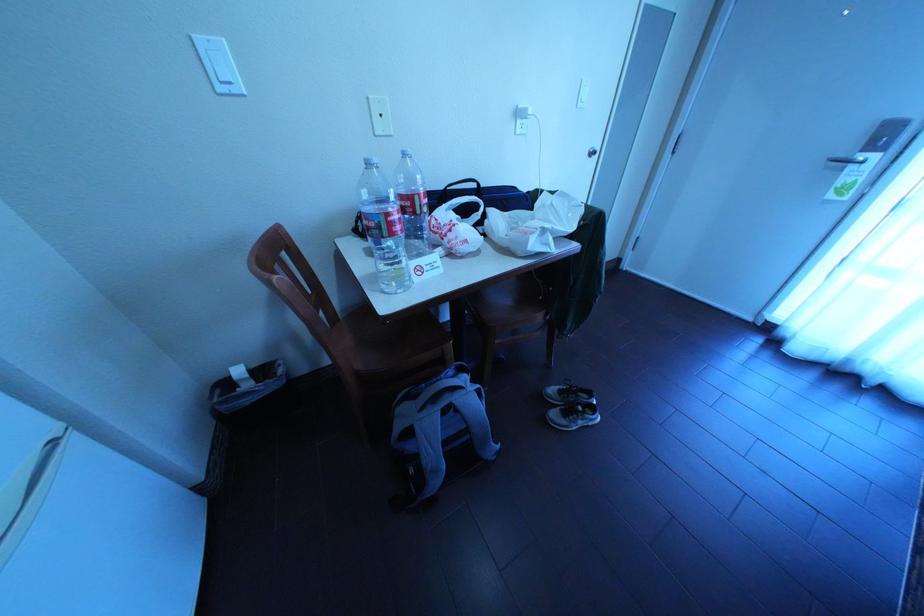
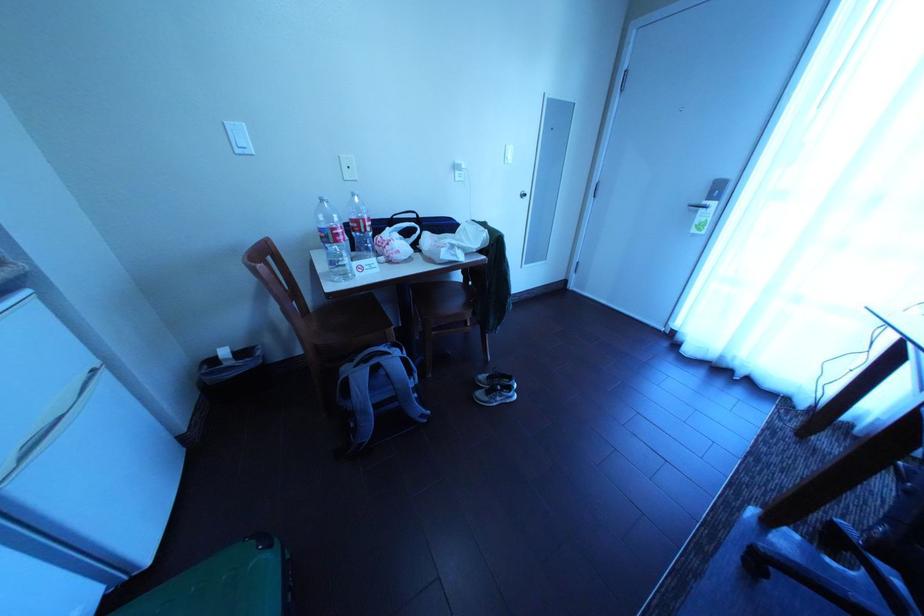
Question: The first image is from the beginning of the video and the second image is from the end. How did the camera likely rotate when shooting the video?

Choices:
 (A) Left
 (B) Right
 (C) Up
 (D) Down

Answer: (C)